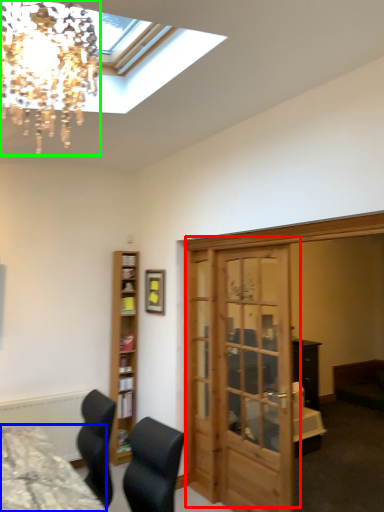
Question: Which object is the farthest from door (highlighted by a red box)? Choose among these: desk (highlighted by a blue box) or lamp (highlighted by a green box).

Choices:
 (A) desk
 (B) lamp

Answer: (B)